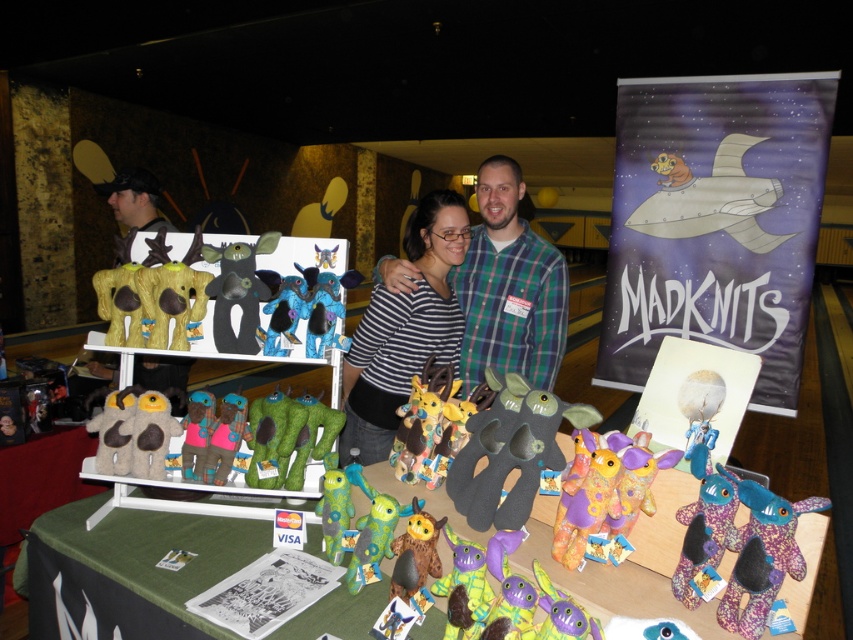
You are organizing a craft fair booth and need to arrange items according to a layout plan. According to the image, where is the green fabric table at center in relation to the dark gray felt toy at center?

The green fabric table at center is to the left of the dark gray felt toy at center.

You are organizing a display at the craft fair. You need to place a new decorative item on the table where the fluffy yellow plush at center and the fuzzy fabric plush at center are already positioned. Where should you place the new item so it doesn

The fluffy yellow plush at center is located above the fuzzy fabric plush at center, so placing the new item below the fuzzy fabric plush at center would ensure it is below both existing plushies.